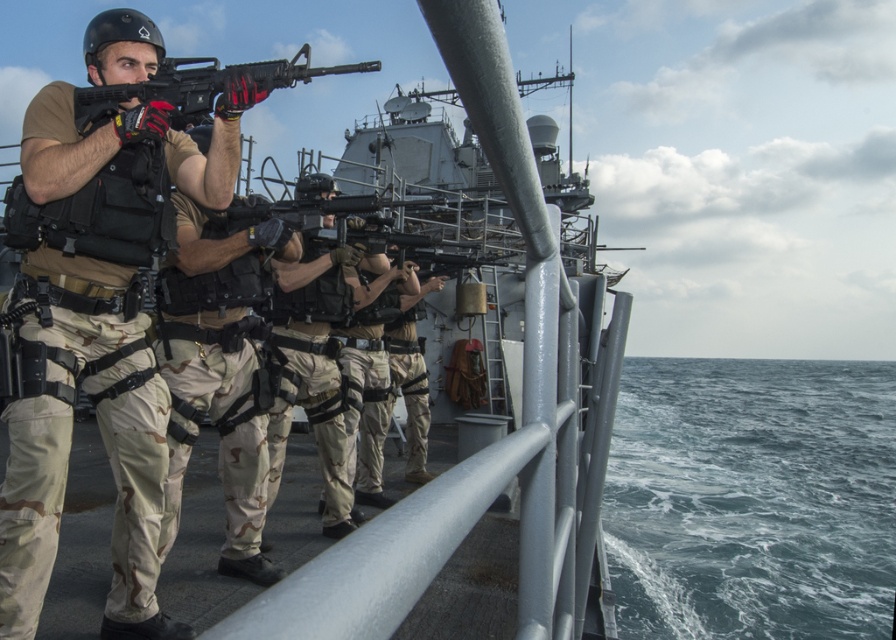
You are a sailor on the deck of the ship and need to assess the distance between the blue water at lower right and the camouflage pants at center. Which one is higher from the deck?

The blue water at lower right has a greater height compared to the camouflage pants at center, so the blue water at lower right is higher from the deck.